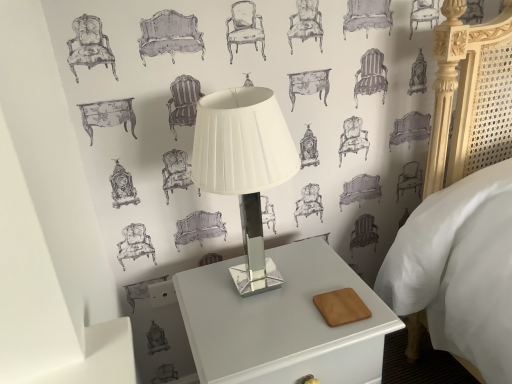
Question: Does white glossy table lamp at center appear on the left side of white glossy nightstand at center?

Choices:
 (A) yes
 (B) no

Answer: (A)

Question: Does white glossy table lamp at center have a lesser height compared to white glossy nightstand at center?

Choices:
 (A) no
 (B) yes

Answer: (B)

Question: Considering the relative positions of white glossy table lamp at center and white glossy nightstand at center in the image provided, is white glossy table lamp at center to the right of white glossy nightstand at center from the viewer's perspective?

Choices:
 (A) no
 (B) yes

Answer: (A)

Question: Can you see white glossy table lamp at center touching white glossy nightstand at center?

Choices:
 (A) no
 (B) yes

Answer: (A)

Question: Is white glossy table lamp at center not within white glossy nightstand at center?

Choices:
 (A) yes
 (B) no

Answer: (A)

Question: Could white glossy nightstand at center be considered to be inside white glossy table lamp at center?

Choices:
 (A) yes
 (B) no

Answer: (B)

Question: Does white glossy nightstand at center appear on the right side of white glossy table lamp at center?

Choices:
 (A) yes
 (B) no

Answer: (A)

Question: From a real-world perspective, is white glossy nightstand at center on white glossy table lamp at center?

Choices:
 (A) yes
 (B) no

Answer: (B)

Question: From a real-world perspective, does white glossy nightstand at center sit lower than white glossy table lamp at center?

Choices:
 (A) yes
 (B) no

Answer: (A)

Question: Is white glossy nightstand at center thinner than white glossy table lamp at center?

Choices:
 (A) no
 (B) yes

Answer: (A)

Question: Is white glossy nightstand at center facing towards white glossy table lamp at center?

Choices:
 (A) no
 (B) yes

Answer: (A)

Question: Does white glossy nightstand at center appear on the left side of white glossy table lamp at center?

Choices:
 (A) no
 (B) yes

Answer: (A)

Question: In the image, is white glossy table lamp at center positioned in front of or behind white glossy nightstand at center?

Choices:
 (A) behind
 (B) front

Answer: (B)